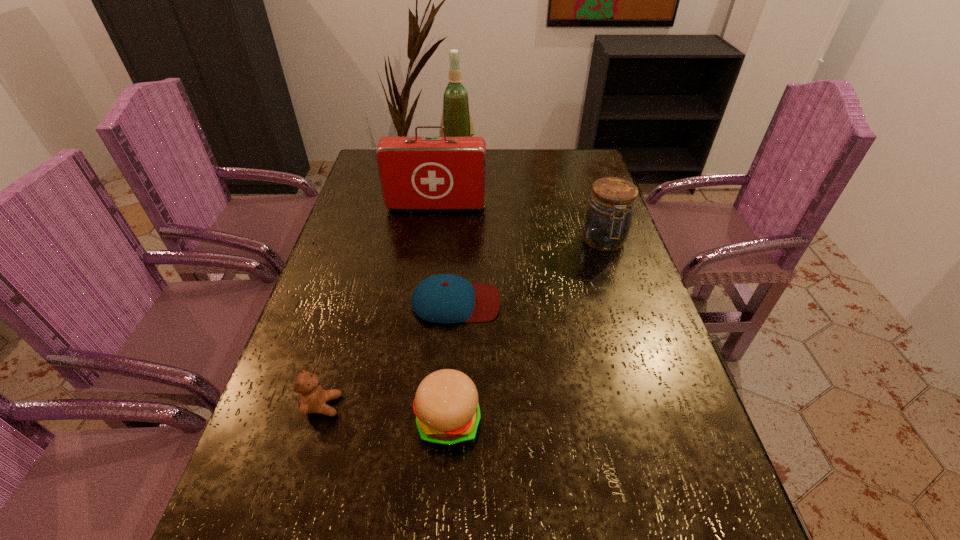
The image size is (960, 540). Identify the location of free region at the far edge of the desktop. (509, 153).

This screenshot has width=960, height=540. In the image, there is a desktop. In order to click on vacant space at the left edge in this screenshot , I will do `click(292, 489)`.

The height and width of the screenshot is (540, 960). In the image, there is a desktop. In order to click on free space at the right edge in this screenshot , I will do `click(652, 418)`.

Find the location of a particular element. This screenshot has height=540, width=960. free spot at the far right corner of the desktop is located at coordinates (594, 171).

Locate an element on the screen. free spot between the fourth nearest object and the baseball cap is located at coordinates (530, 272).

Locate an element on the screen. The width and height of the screenshot is (960, 540). vacant space that's between the teddy bear and the shortest object is located at coordinates (389, 354).

Identify the location of vacant area between the hamburger and the teddy bear. Image resolution: width=960 pixels, height=540 pixels. (385, 413).

At what (x,y) coordinates should I click in order to perform the action: click on blank region between the first-aid kit and the third tallest object. Please return your answer as a coordinate pair (x, y). Image resolution: width=960 pixels, height=540 pixels. Looking at the image, I should click on (520, 224).

What are the coordinates of `free space between the rightmost object and the hamburger` in the screenshot? It's located at (526, 331).

Where is `vacant area that lies between the fourth shortest object and the teddy bear`? vacant area that lies between the fourth shortest object and the teddy bear is located at coordinates (463, 323).